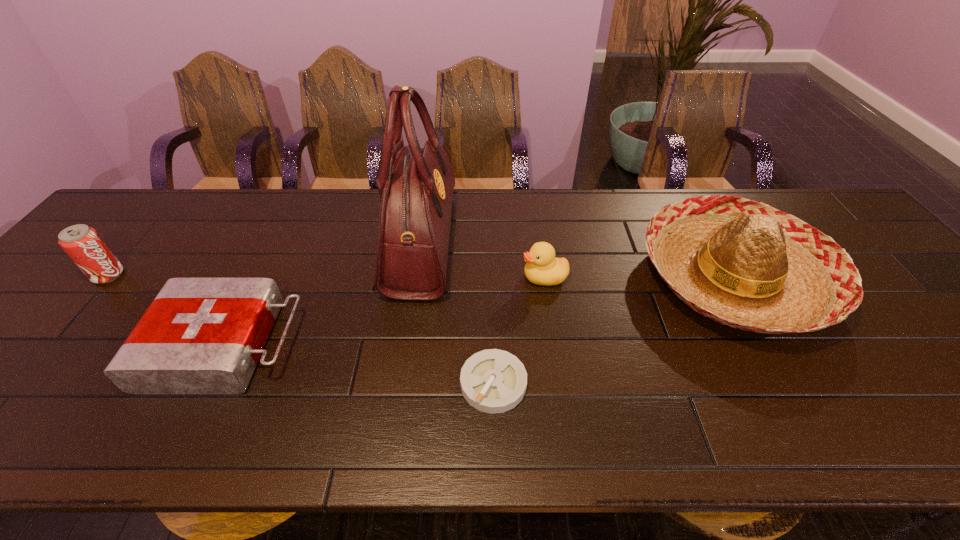
You are a GUI agent. You are given a task and a screenshot of the screen. Output one action in this format:
    pyautogui.click(x=<x>, y=<y>)
    Task: Click on the handbag that is positioned at the far edge
    
    Given the screenshot: What is the action you would take?
    pyautogui.click(x=416, y=185)

Find the location of `sombrero at the far edge`. sombrero at the far edge is located at coordinates (742, 263).

What are the coordinates of `object at the near edge` in the screenshot? It's located at (493, 381).

The height and width of the screenshot is (540, 960). What are the coordinates of `object at the left edge` in the screenshot? It's located at (82, 243).

Identify the location of free spot at the far edge of the desktop. This screenshot has width=960, height=540. (604, 225).

Image resolution: width=960 pixels, height=540 pixels. In order to click on free point at the near edge in this screenshot , I will do `click(902, 445)`.

You are a GUI agent. You are given a task and a screenshot of the screen. Output one action in this format:
    pyautogui.click(x=<x>, y=<y>)
    Task: Click on the free space at the left edge of the desktop
    The width and height of the screenshot is (960, 540).
    Given the screenshot: What is the action you would take?
    point(35,381)

Find the location of a particular element. This screenshot has height=540, width=960. vacant space at the right edge is located at coordinates (910, 359).

Locate an element on the screen. Image resolution: width=960 pixels, height=540 pixels. vacant space at the far right corner of the desktop is located at coordinates (821, 196).

Find the location of a particular element. vacant space in between the duck and the fifth object from right to left is located at coordinates (385, 311).